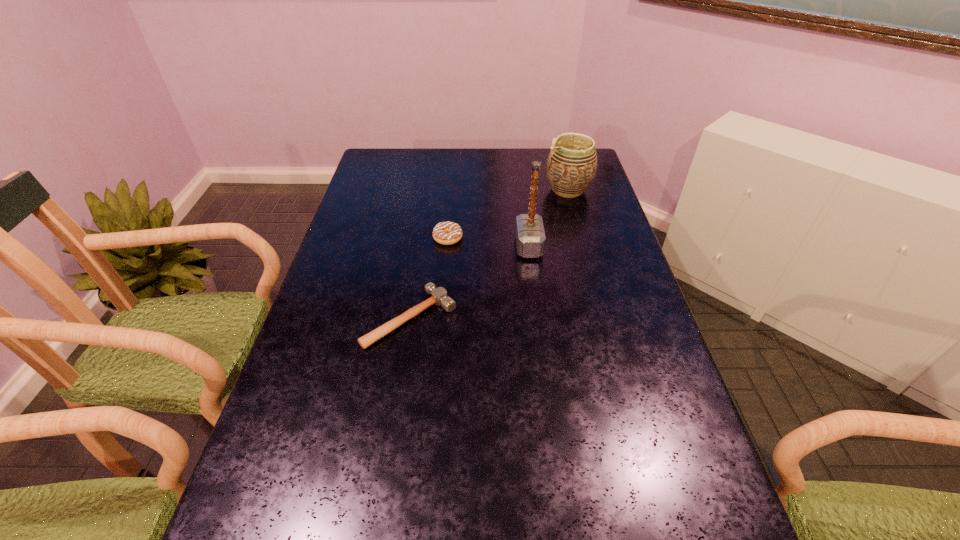
Identify the location of vacant point at the far left corner. The height and width of the screenshot is (540, 960). (375, 166).

Locate an element on the screen. This screenshot has height=540, width=960. empty location between the nearest object and the pottery is located at coordinates (490, 254).

Identify the location of empty location between the rightmost object and the nearer hammer. This screenshot has height=540, width=960. [x=490, y=254].

Where is `unoccupied position between the nearest object and the doughnut`? The image size is (960, 540). unoccupied position between the nearest object and the doughnut is located at coordinates (429, 278).

You are a GUI agent. You are given a task and a screenshot of the screen. Output one action in this format:
    pyautogui.click(x=<x>, y=<y>)
    Task: Click on the free area in between the doughnut and the rightmost object
    The height and width of the screenshot is (540, 960).
    Given the screenshot: What is the action you would take?
    pyautogui.click(x=508, y=214)

The height and width of the screenshot is (540, 960). In order to click on free spot between the nearer hammer and the doughnut in this screenshot , I will do `click(429, 278)`.

Identify the location of unoccupied area between the nearer hammer and the farther hammer. (469, 282).

The height and width of the screenshot is (540, 960). Find the location of `blank region between the nearest object and the doughnut`. blank region between the nearest object and the doughnut is located at coordinates (429, 278).

At what (x,y) coordinates should I click in order to perform the action: click on free spot between the nearest object and the doughnut. Please return your answer as a coordinate pair (x, y). The width and height of the screenshot is (960, 540). Looking at the image, I should click on (429, 278).

At what (x,y) coordinates should I click in order to perform the action: click on empty space that is in between the farther hammer and the nearer hammer. Please return your answer as a coordinate pair (x, y). Looking at the image, I should click on (469, 282).